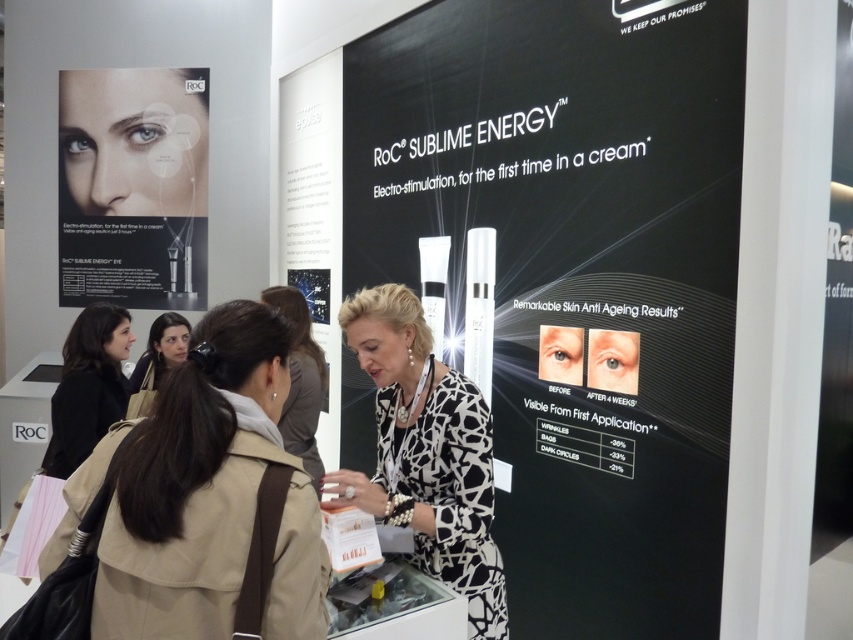
You are a customer at the RoC Sublime Energy booth. You notice the matte black eye cream at upper left and the matte black hair at center. Which product is positioned higher on the display?

The matte black eye cream at upper left is positioned higher than the matte black hair at center.

You are at a trade show booth for RoC Sublime Energy. You see a white glossy poster at center and a black printed dress at center. Which object is positioned higher?

The white glossy poster at center is located above the black printed dress at center, so the white glossy poster at center is positioned higher.

Looking at this image, you are a photographer at the RoC Sublime Energy booth. You need to adjust the lighting so that the matte black eye cream at upper left and the brown leather jacket at center are both well lit. Which object should you focus on first to ensure proper lighting for both?

You should focus on the matte black eye cream at upper left first because it is closer to you than the brown leather jacket at center, so adjusting its lighting ensures the jacket further back will also be illuminated adequately.